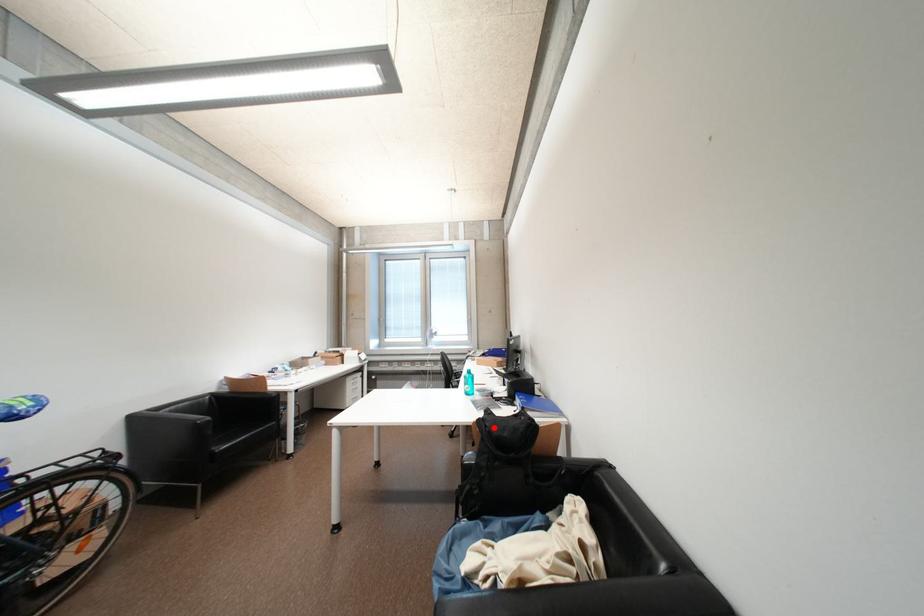
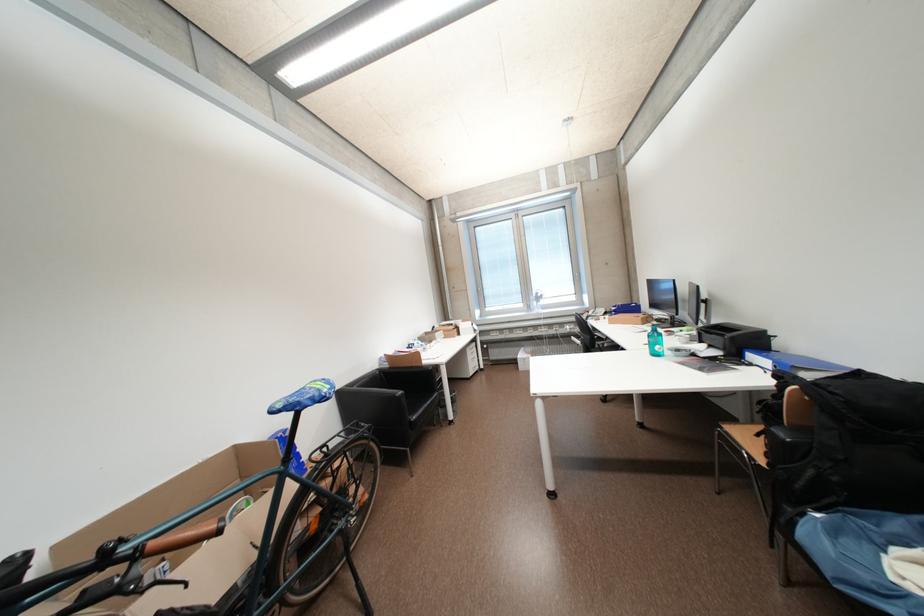
In the second image, find the point that corresponds to the highlighted location in the first image.

(841, 395)